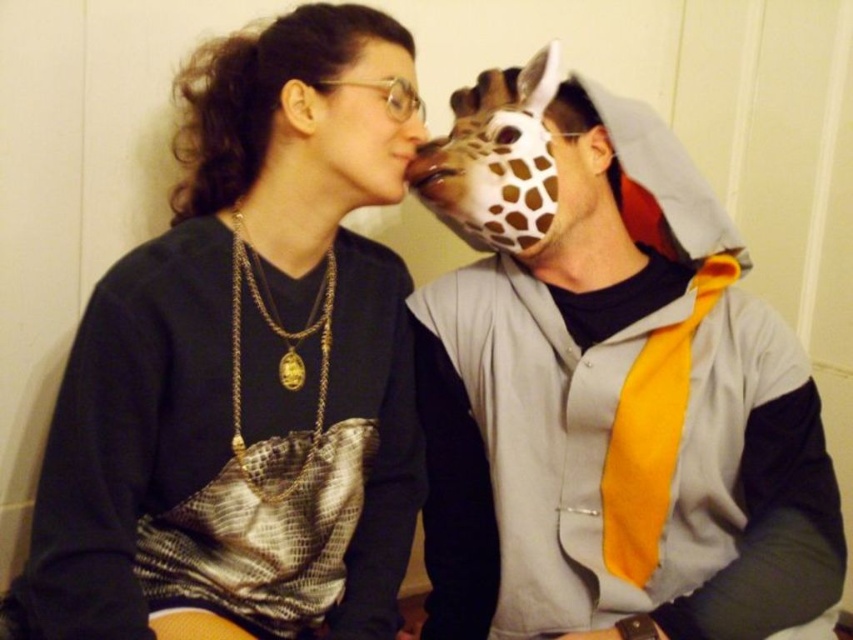
You are standing in front of the scene and want to locate the matte gray hoodie at center. What are the coordinates of its position?

The matte gray hoodie at center is located at point (x=607, y=388).